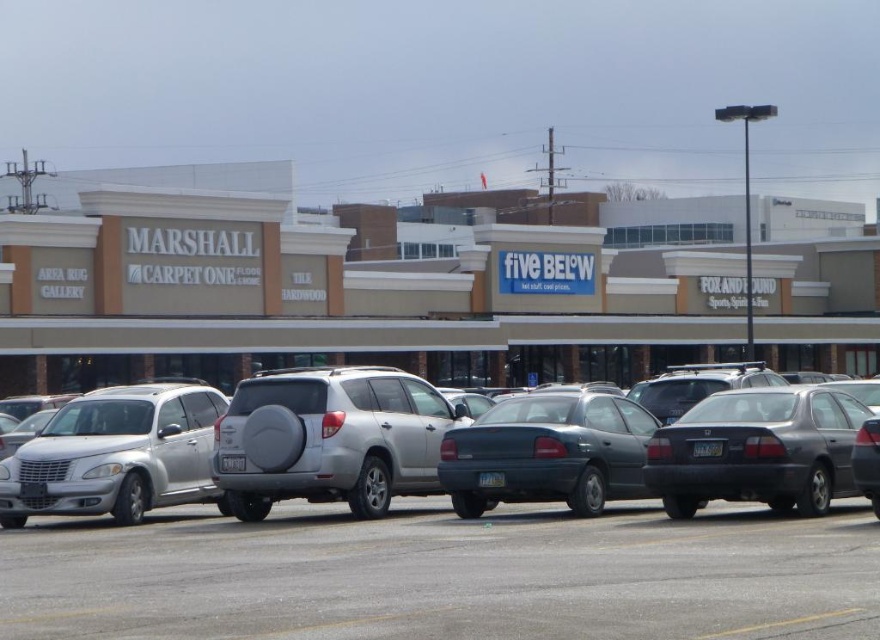
From the picture: Does beige/concrete mall at center lie behind dark gray matte sedan at center?

Yes, beige/concrete mall at center is behind dark gray matte sedan at center.

Image resolution: width=880 pixels, height=640 pixels. What do you see at coordinates (334, 291) in the screenshot? I see `beige/concrete mall at center` at bounding box center [334, 291].

You are a GUI agent. You are given a task and a screenshot of the screen. Output one action in this format:
    pyautogui.click(x=<x>, y=<y>)
    Task: Click on the beige/concrete mall at center
    The width and height of the screenshot is (880, 640).
    Given the screenshot: What is the action you would take?
    pyautogui.click(x=334, y=291)

Does beige/concrete mall at center appear over silver metallic suv at left?

Yes.

Does beige/concrete mall at center have a larger size compared to silver metallic suv at left?

Yes.

This screenshot has width=880, height=640. Find the location of `beige/concrete mall at center`. beige/concrete mall at center is located at coordinates (334, 291).

Can you confirm if beige/concrete mall at center is positioned to the right of silver metallic suv at center?

In fact, beige/concrete mall at center is to the left of silver metallic suv at center.

Who is more distant from viewer, (156, 316) or (361, 371)?

The point (156, 316) is behind.

I want to click on beige/concrete mall at center, so click(334, 291).